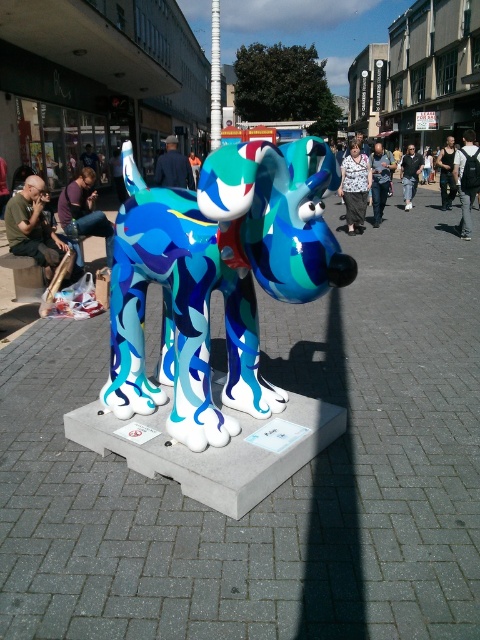
Between green matte shirt at left and white plastic pole at center, which one appears on the left side from the viewer's perspective?

Positioned to the left is green matte shirt at left.

You are a GUI agent. You are given a task and a screenshot of the screen. Output one action in this format:
    pyautogui.click(x=<x>, y=<y>)
    Task: Click on the green matte shirt at left
    
    Given the screenshot: What is the action you would take?
    pyautogui.click(x=36, y=230)

Is point (79, 588) closer to viewer compared to point (139, 230)?

Yes.

Is smooth concrete base at center smaller than shiny metallic dog at center?

Indeed, smooth concrete base at center has a smaller size compared to shiny metallic dog at center.

Is point (359, 636) closer to camera compared to point (131, 209)?

Yes, point (359, 636) is in front of point (131, 209).

At what (x,y) coordinates should I click in order to perform the action: click on smooth concrete base at center. Please return your answer as a coordinate pair (x, y). This screenshot has width=480, height=640. Looking at the image, I should click on (277, 488).

Does green matte shirt at left appear over black cotton t-shirt at center?

Actually, green matte shirt at left is below black cotton t-shirt at center.

Is green matte shirt at left smaller than black cotton t-shirt at center?

Yes.

Locate an element on the screen. Image resolution: width=480 pixels, height=640 pixels. green matte shirt at left is located at coordinates (36, 230).